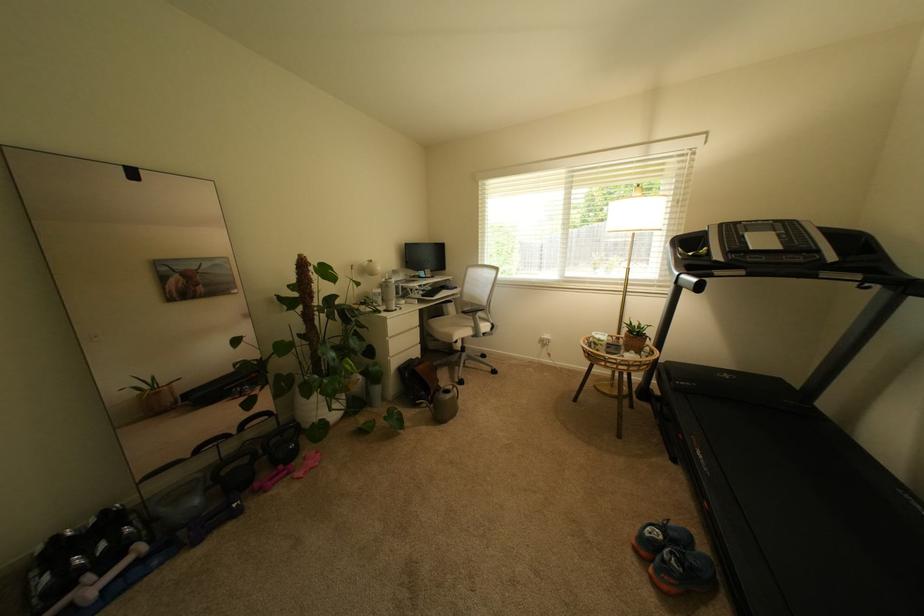
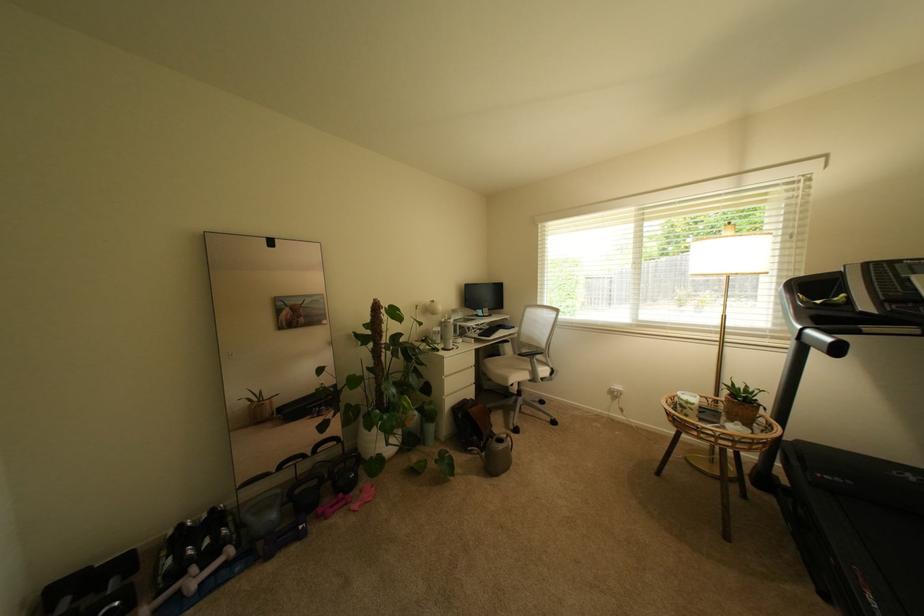
Find the pixel in the second image that matches pixel 446 387 in the first image.

(500, 432)